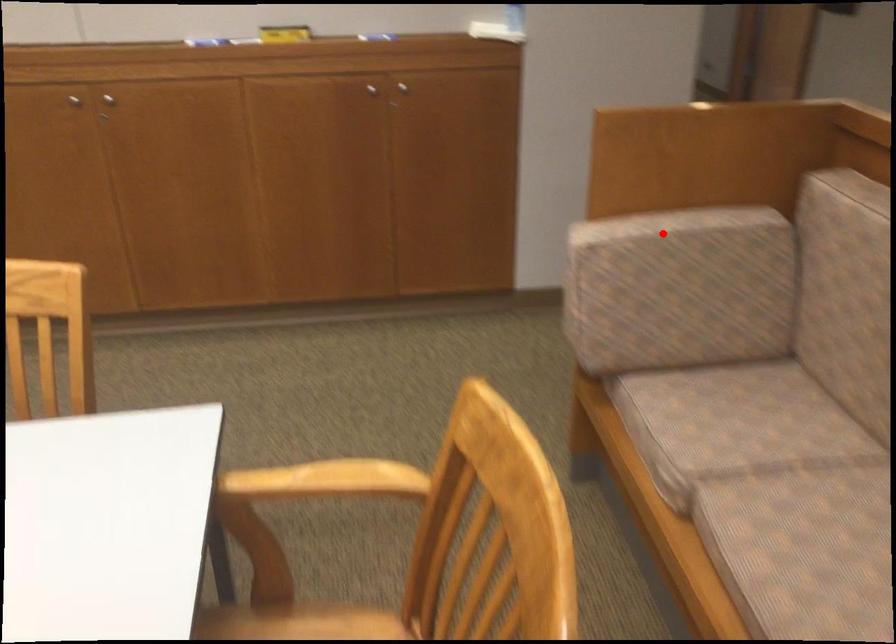
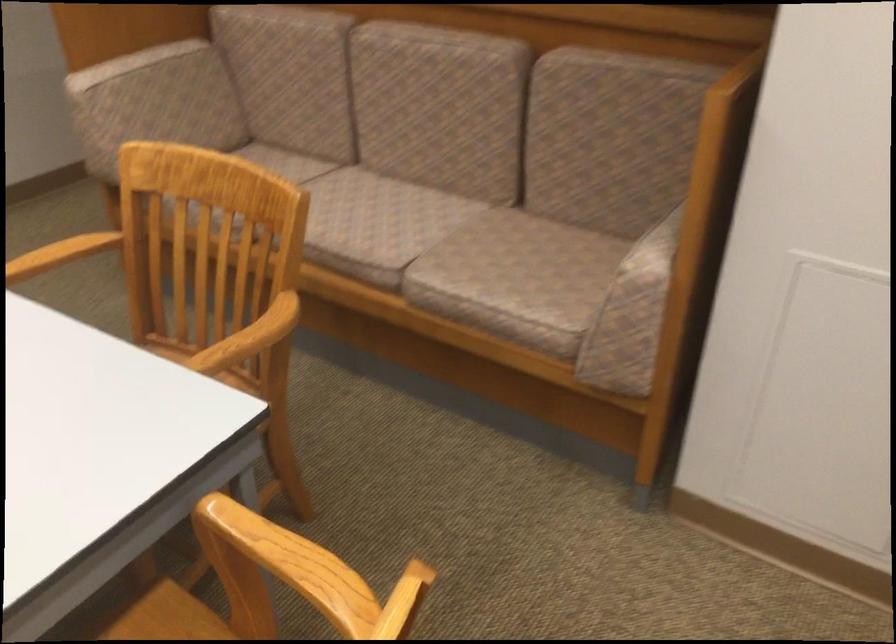
Question: I am providing you with two images of the same scene from different viewpoints. In image1, a red point is highlighted. Considering the same 3D point in image2, which of the following is correct?

Choices:
 (A) It is closer
 (B) It is farther

Answer: (B)